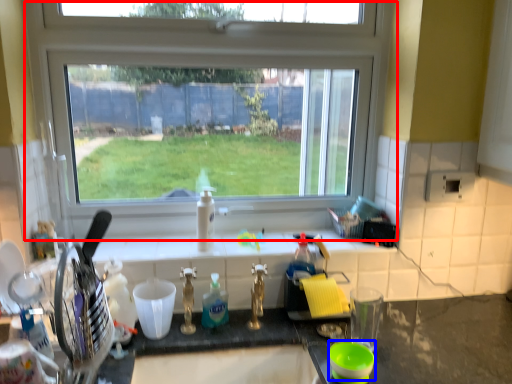
Question: Which object is closer to the camera taking this photo, window (highlighted by a red box) or basin (highlighted by a blue box)?

Choices:
 (A) window
 (B) basin

Answer: (B)